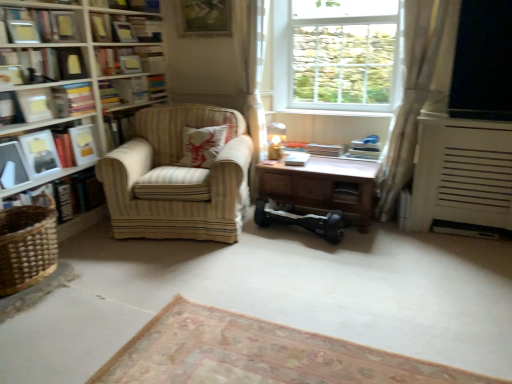
Where is `free area in between brown wooden table at center and carpeted floor at lower center, the 2th plain positioned from the front`? free area in between brown wooden table at center and carpeted floor at lower center, the 2th plain positioned from the front is located at coordinates (317, 284).